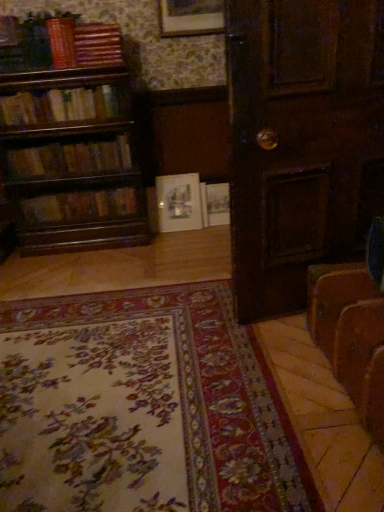
You are a GUI agent. You are given a task and a screenshot of the screen. Output one action in this format:
    pyautogui.click(x=<x>, y=<y>)
    Task: Click on the free location above hardcover book at left, which appears as the first book when ordered from the bottom (from a real-world perspective)
    
    Given the screenshot: What is the action you would take?
    pyautogui.click(x=86, y=189)